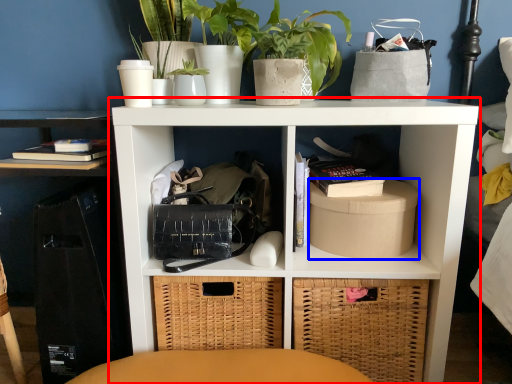
Question: Among these objects, which one is farthest to the camera, shelf (highlighted by a red box) or cardboard box (highlighted by a blue box)?

Choices:
 (A) shelf
 (B) cardboard box

Answer: (B)